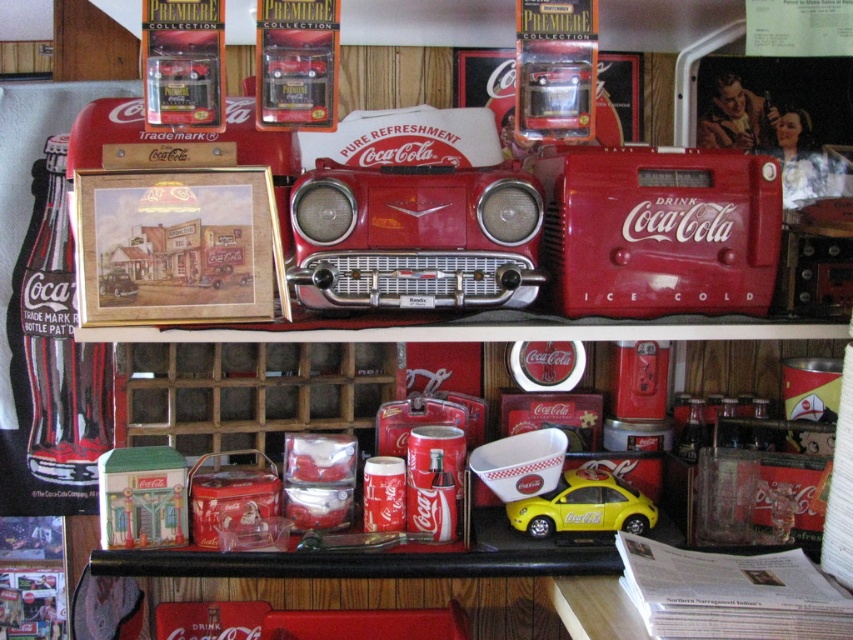
Is point (33, 460) farther from viewer compared to point (119, 522)?

Yes, it is behind point (119, 522).

Who is shorter, glass coca-cola bottle at left or matte tin building at center?

matte tin building at center

Between point (62, 172) and point (167, 545), which one is positioned in front?

Point (167, 545)

Locate an element on the screen. Image resolution: width=853 pixels, height=640 pixels. glass coca-cola bottle at left is located at coordinates (61, 346).

Looking at this image, measure the distance between metallic red car at center and camera.

3.42 feet

What are the coordinates of `metallic red car at center` in the screenshot? It's located at (415, 237).

At what (x,y) coordinates should I click in order to perform the action: click on metallic red car at center. Please return your answer as a coordinate pair (x, y). The width and height of the screenshot is (853, 640). Looking at the image, I should click on (415, 237).

Find the location of a particular element. Image resolution: width=853 pixels, height=640 pixels. metallic red car at center is located at coordinates (415, 237).

Can you confirm if metallic red car at center is smaller than matte tin building at center?

No.

Who is higher up, metallic red car at center or matte tin building at center?

metallic red car at center is higher up.

Who is more distant from viewer, (x=361, y=228) or (x=155, y=452)?

The point (x=155, y=452) is more distant.

Where is `metallic red car at center`? This screenshot has width=853, height=640. metallic red car at center is located at coordinates (415, 237).